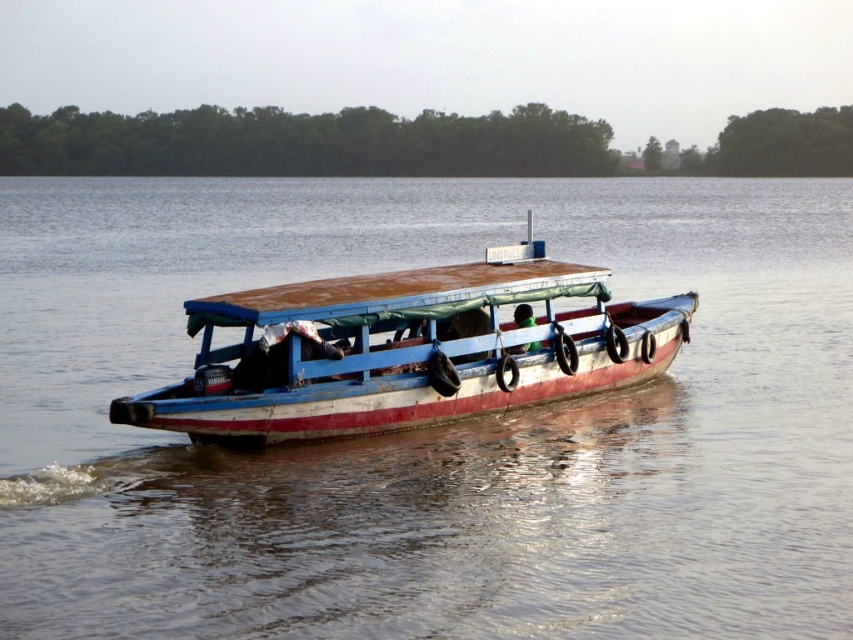
Looking at this image, you are a passenger on a boat and need to choose between the brown wooden boat at center and the rusty metal boat at center. Which boat has a higher roof to provide more shade?

The brown wooden boat at center has a greater height compared to the rusty metal boat at center, so it provides more shade.

Where is the brown wooden boat at center located in the image?

The brown wooden boat at center is located at point (428, 428) in the image.

You are standing on the dock and see the point at coordinates (428, 428). What object does this point correspond to in the boat?

The point at coordinates (428, 428) corresponds to the brown wooden boat at center.